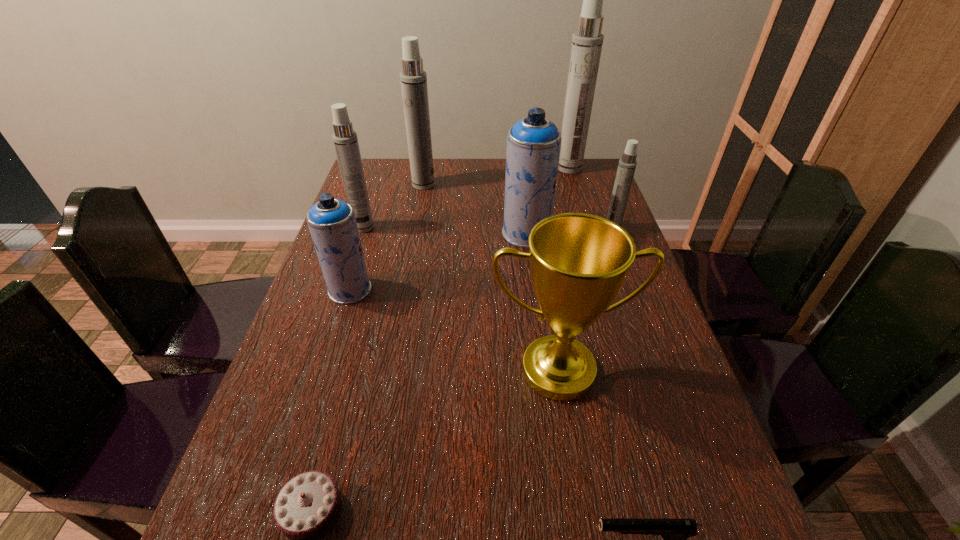
Locate an element on the screen. award at the right edge is located at coordinates (578, 262).

Identify the location of object that is at the far right corner. pyautogui.click(x=587, y=41).

This screenshot has height=540, width=960. What are the coordinates of `free point at the far edge` in the screenshot? It's located at (461, 181).

Image resolution: width=960 pixels, height=540 pixels. I want to click on vacant space at the left edge, so (222, 524).

Find the location of `vacant point at the right edge`. vacant point at the right edge is located at coordinates (604, 212).

Image resolution: width=960 pixels, height=540 pixels. I want to click on vacant area at the far right corner of the desktop, so click(x=579, y=186).

Identify the location of empty space between the farthest white aerosol can and the third biggest white aerosol can. (467, 198).

At what (x,y) coordinates should I click in order to perform the action: click on empty space between the farthest white aerosol can and the rightmost aerosol can. Please return your answer as a coordinate pair (x, y). Looking at the image, I should click on (590, 198).

Identify the location of vacant space that's between the award and the second farthest white aerosol can. (491, 278).

Where is `free point between the seventh farthest object and the fifth shortest aerosol can`? The height and width of the screenshot is (540, 960). free point between the seventh farthest object and the fifth shortest aerosol can is located at coordinates (491, 278).